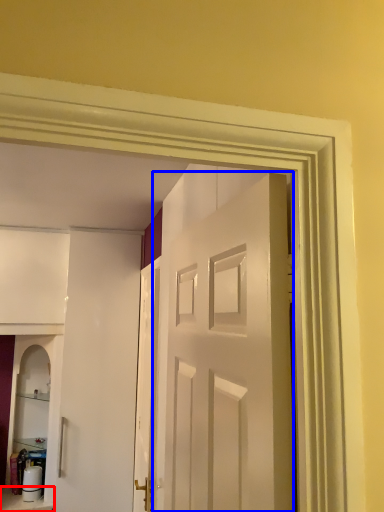
Question: Which of the following is the closest to the observer, furniture (highlighted by a red box) or door (highlighted by a blue box)?

Choices:
 (A) furniture
 (B) door

Answer: (B)